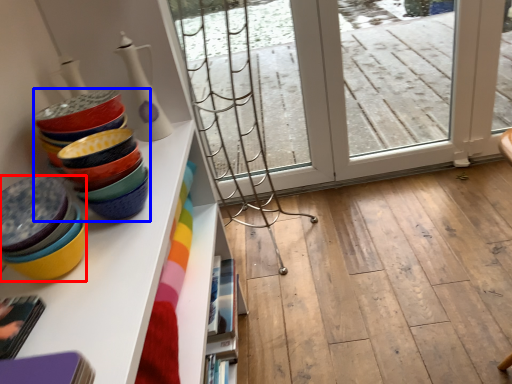
Question: Which of the following is the farthest to the observer, table (highlighted by a red box) or tableware (highlighted by a blue box)?

Choices:
 (A) table
 (B) tableware

Answer: (B)